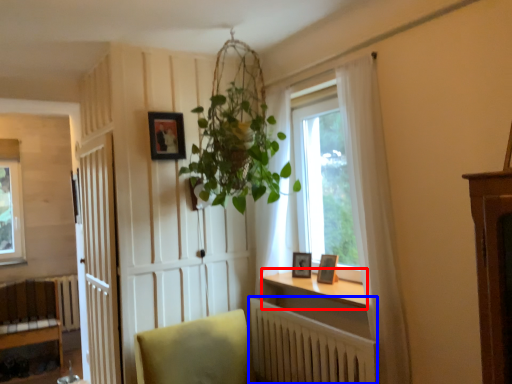
Question: Which object is further to the camera taking this photo, window sill (highlighted by a red box) or radiator (highlighted by a blue box)?

Choices:
 (A) window sill
 (B) radiator

Answer: (A)